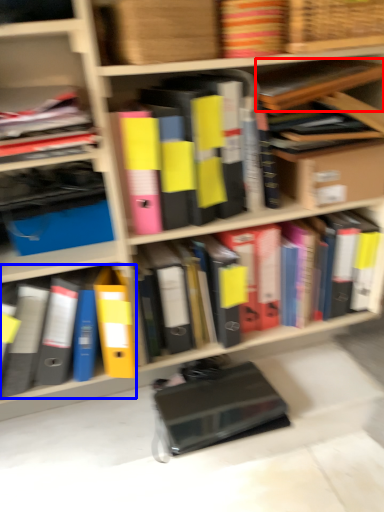
Question: Which point is further to the camera, book (highlighted by a red box) or book (highlighted by a blue box)?

Choices:
 (A) book
 (B) book

Answer: (B)